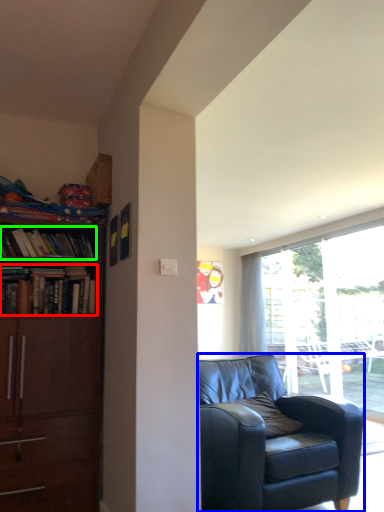
Question: Which is farther away from book (highlighted by a red box)? chair (highlighted by a blue box) or book (highlighted by a green box)?

Choices:
 (A) chair
 (B) book

Answer: (A)